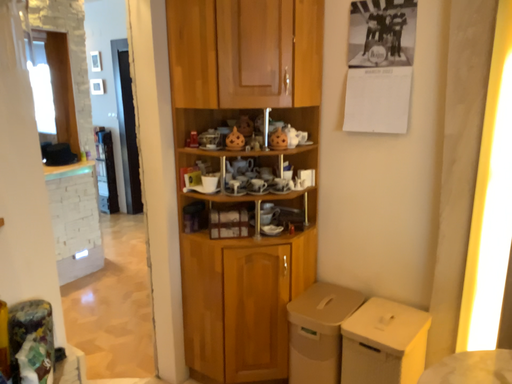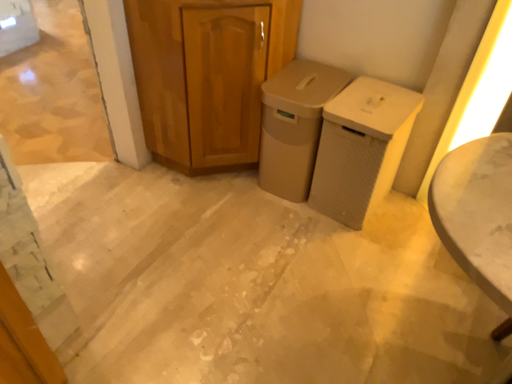
Question: Which way did the camera rotate in the video?

Choices:
 (A) rotated upward
 (B) rotated downward

Answer: (B)